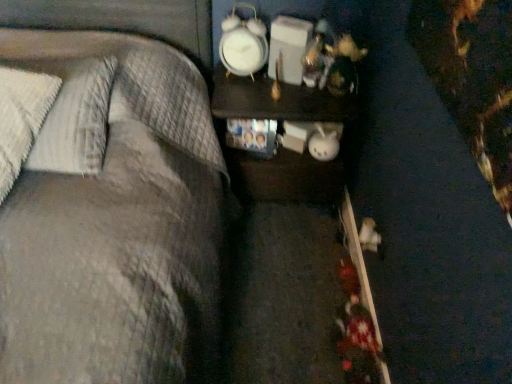
Question: Is white textured pillow at left surrounding dark wood nightstand at center?

Choices:
 (A) yes
 (B) no

Answer: (B)

Question: Considering the relative sizes of white textured pillow at left and dark wood nightstand at center in the image provided, is white textured pillow at left wider than dark wood nightstand at center?

Choices:
 (A) no
 (B) yes

Answer: (B)

Question: Can you confirm if white textured pillow at left is shorter than dark wood nightstand at center?

Choices:
 (A) yes
 (B) no

Answer: (A)

Question: From a real-world perspective, is white textured pillow at left on dark wood nightstand at center?

Choices:
 (A) no
 (B) yes

Answer: (B)

Question: Does white textured pillow at left have a larger size compared to dark wood nightstand at center?

Choices:
 (A) yes
 (B) no

Answer: (B)

Question: In the image, is dark wood nightstand at center positioned in front of or behind white textured pillow at left?

Choices:
 (A) front
 (B) behind

Answer: (B)

Question: From a real-world perspective, relative to white textured pillow at left, is dark wood nightstand at center vertically above or below?

Choices:
 (A) below
 (B) above

Answer: (A)

Question: Is point (234, 157) positioned closer to the camera than point (70, 104)?

Choices:
 (A) farther
 (B) closer

Answer: (A)

Question: In the image, is dark wood nightstand at center on the left side or the right side of white textured pillow at left?

Choices:
 (A) right
 (B) left

Answer: (A)

Question: Does point [x=234, y=64] appear closer or farther from the camera than point [x=243, y=89]?

Choices:
 (A) farther
 (B) closer

Answer: (A)

Question: From a real-world perspective, is white plastic clock at upper center above or below dark wood nightstand at center?

Choices:
 (A) above
 (B) below

Answer: (A)

Question: Choose the correct answer: Is white plastic clock at upper center inside dark wood nightstand at center or outside it?

Choices:
 (A) outside
 (B) inside

Answer: (A)

Question: Considering the positions of white plastic clock at upper center and dark wood nightstand at center in the image, is white plastic clock at upper center taller or shorter than dark wood nightstand at center?

Choices:
 (A) tall
 (B) short

Answer: (B)

Question: Considering their positions, is dark wood nightstand at center located in front of or behind white plastic clock at upper center?

Choices:
 (A) front
 (B) behind

Answer: (B)

Question: Looking at their shapes, would you say dark wood nightstand at center is wider or thinner than white plastic clock at upper center?

Choices:
 (A) wide
 (B) thin

Answer: (A)